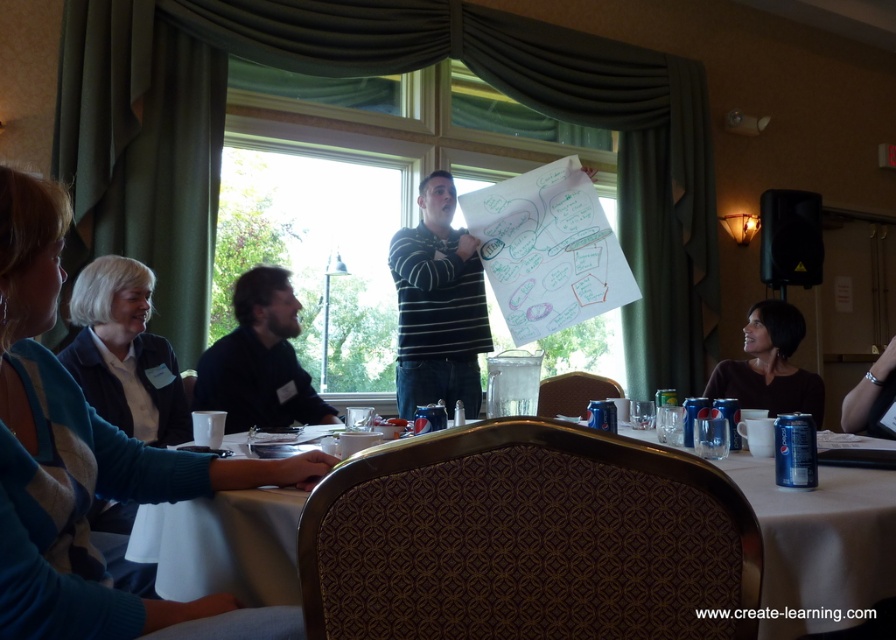
Is dark blue sweater at lower left closer to camera compared to dark blue sweater at center?

That is True.

Can you confirm if dark blue sweater at lower left is wider than dark blue sweater at center?

No.

Where is `dark blue sweater at lower left`? dark blue sweater at lower left is located at coordinates (125, 353).

This screenshot has width=896, height=640. What are the coordinates of `dark blue sweater at lower left` in the screenshot? It's located at (125, 353).

Between striped sweater at left and white fabric table at lower center, which one appears on the right side from the viewer's perspective?

Positioned to the right is white fabric table at lower center.

Can you confirm if striped sweater at left is positioned to the left of white fabric table at lower center?

Yes, striped sweater at left is to the left of white fabric table at lower center.

Measure the distance between point (105, 449) and camera.

Point (105, 449) and camera are 3.74 feet apart from each other.

This screenshot has width=896, height=640. I want to click on striped sweater at left, so click(x=85, y=460).

Between point (269, 547) and point (237, 332), which one is positioned behind?

The point (237, 332) is more distant.

Can you confirm if white fabric table at lower center is positioned to the left of dark blue sweater at center?

In fact, white fabric table at lower center is to the right of dark blue sweater at center.

What do you see at coordinates (820, 541) in the screenshot? I see `white fabric table at lower center` at bounding box center [820, 541].

The width and height of the screenshot is (896, 640). I want to click on white fabric table at lower center, so click(820, 541).